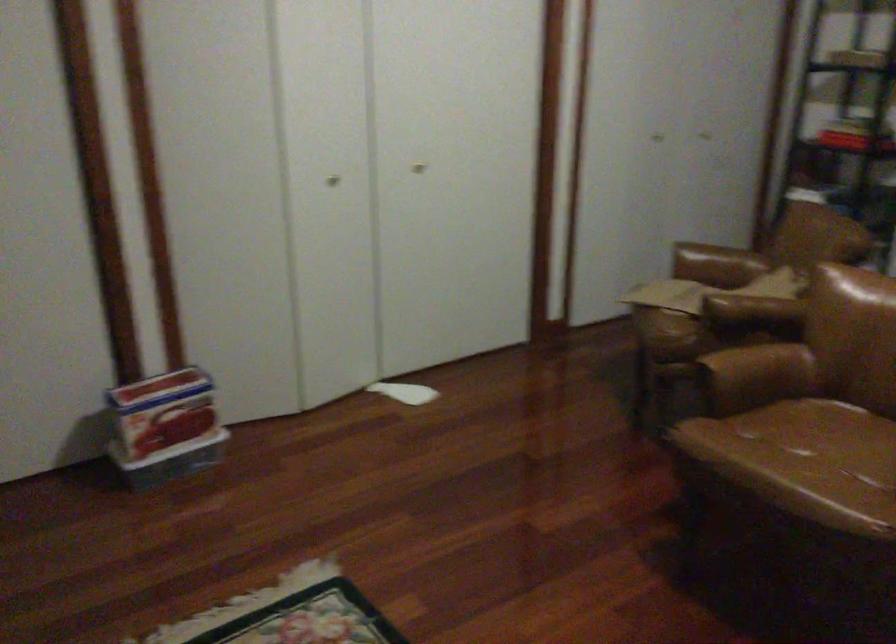
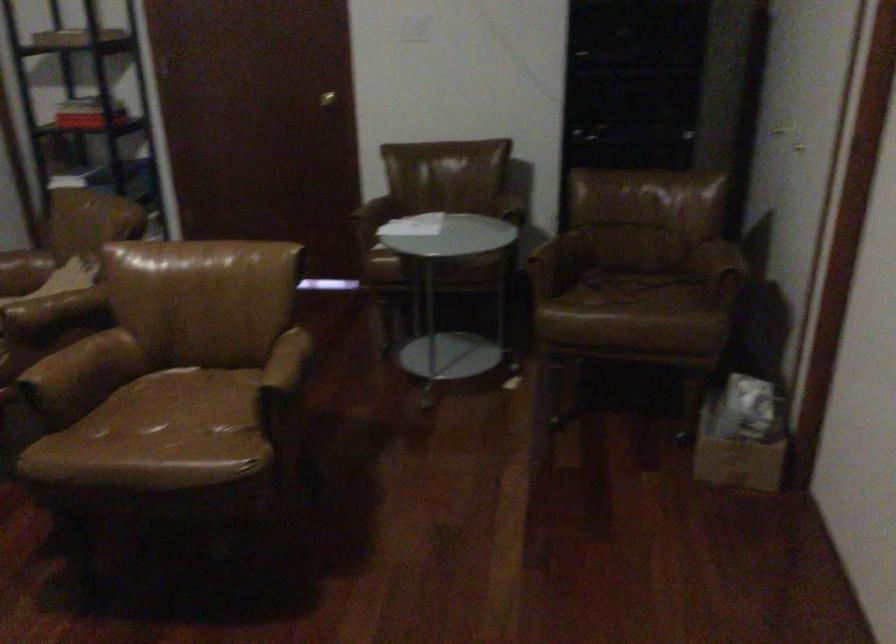
Find the pixel in the second image that matches point 819,448 in the first image.

(178, 413)